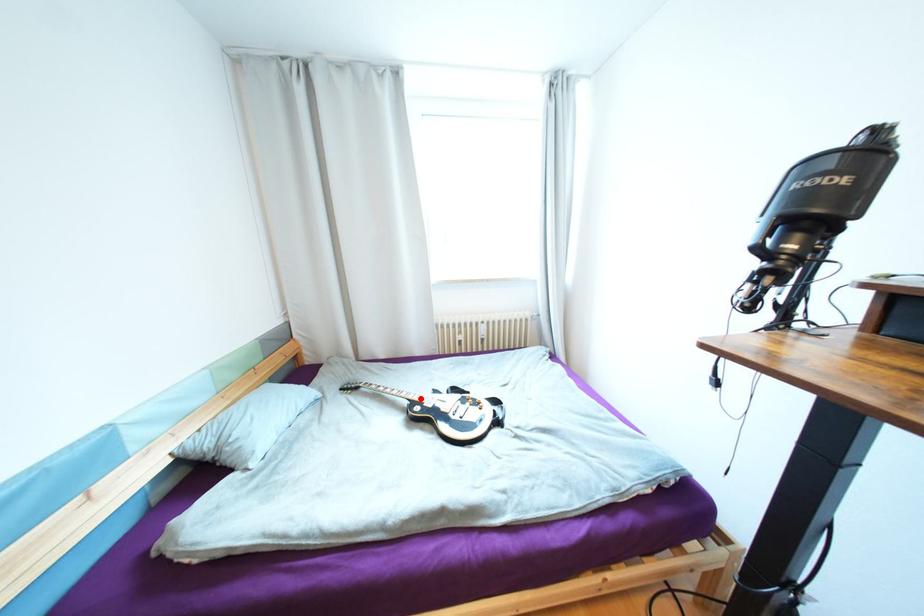
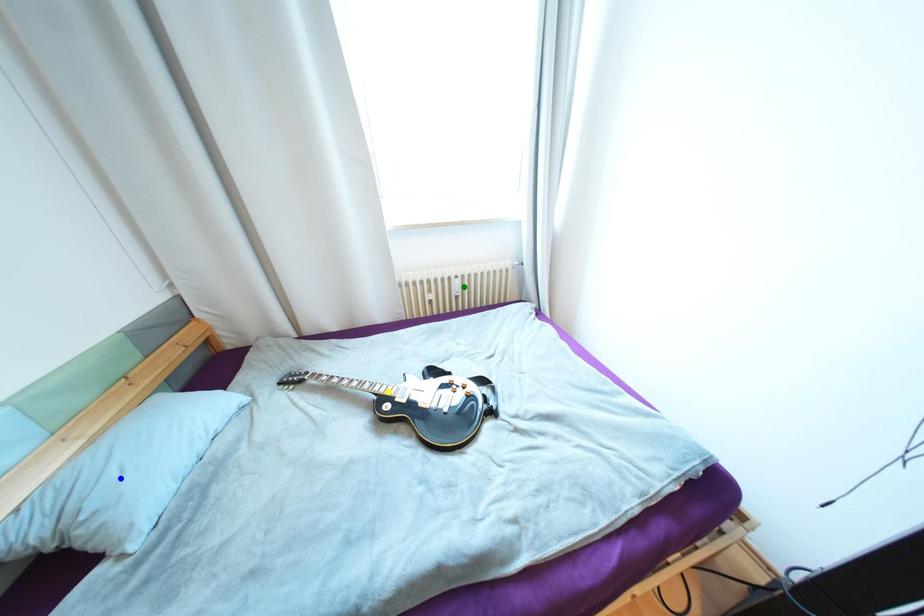
Question: I am providing you with two images of the same scene from different viewpoints. A red point is marked on the first image. You are given multiple points on the second image. Which spot in image 2 lines up with the point in image 1?

Choices:
 (A) yellow point
 (B) green point
 (C) blue point

Answer: (A)